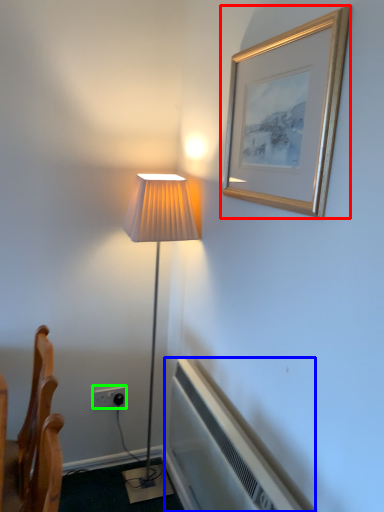
Question: Which object is the farthest from picture frame (highlighted by a red box)? Choose among these: air conditioner (highlighted by a blue box) or electric outlet (highlighted by a green box).

Choices:
 (A) air conditioner
 (B) electric outlet

Answer: (B)